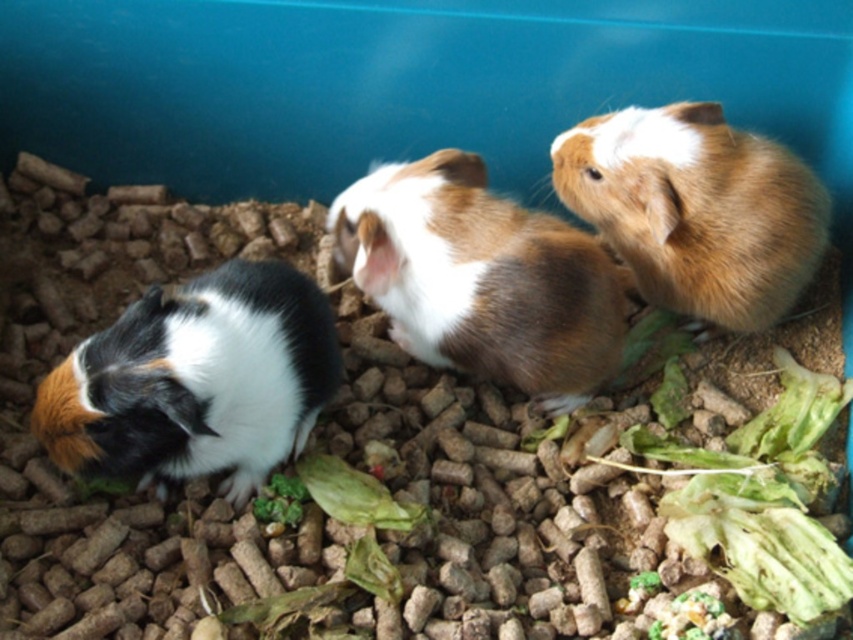
Which of these two, brown fuzzy hamster at center or brown furry hamster at upper right, stands shorter?

With less height is brown furry hamster at upper right.

Is brown fuzzy hamster at center closer to camera compared to brown furry hamster at upper right?

Yes, brown fuzzy hamster at center is in front of brown furry hamster at upper right.

This screenshot has width=853, height=640. What are the coordinates of `brown fuzzy hamster at center` in the screenshot? It's located at (480, 278).

Is black and white fur hamster at left bigger than brown furry hamster at upper right?

Yes.

Looking at this image, which is more to the left, black and white fur hamster at left or brown furry hamster at upper right?

black and white fur hamster at left is more to the left.

Is point (170, 349) more distant than point (717, 156)?

No.

What are the coordinates of `black and white fur hamster at left` in the screenshot? It's located at (195, 381).

Can you confirm if black and white fur hamster at left is smaller than brown fuzzy hamster at center?

Yes.

You are a GUI agent. You are given a task and a screenshot of the screen. Output one action in this format:
    pyautogui.click(x=<x>, y=<y>)
    Task: Click on the black and white fur hamster at left
    
    Given the screenshot: What is the action you would take?
    pyautogui.click(x=195, y=381)